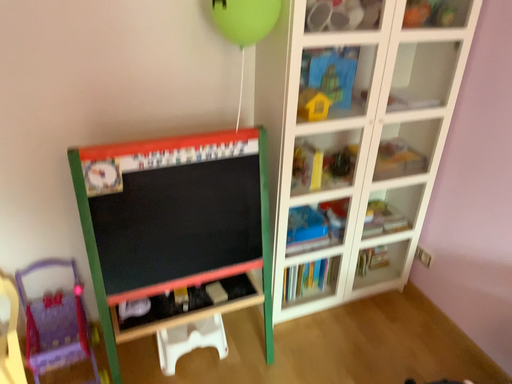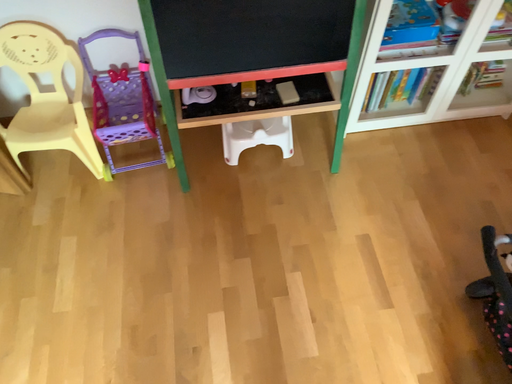
Question: How did the camera likely rotate when shooting the video?

Choices:
 (A) rotated right
 (B) rotated left

Answer: (B)